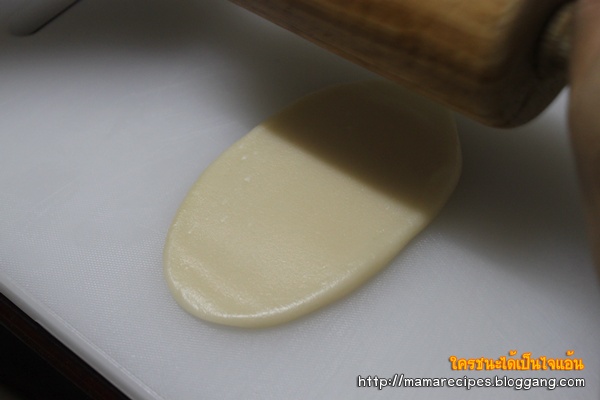
Image resolution: width=600 pixels, height=400 pixels. In order to click on counter below counter top in this screenshot , I will do pos(45,373).